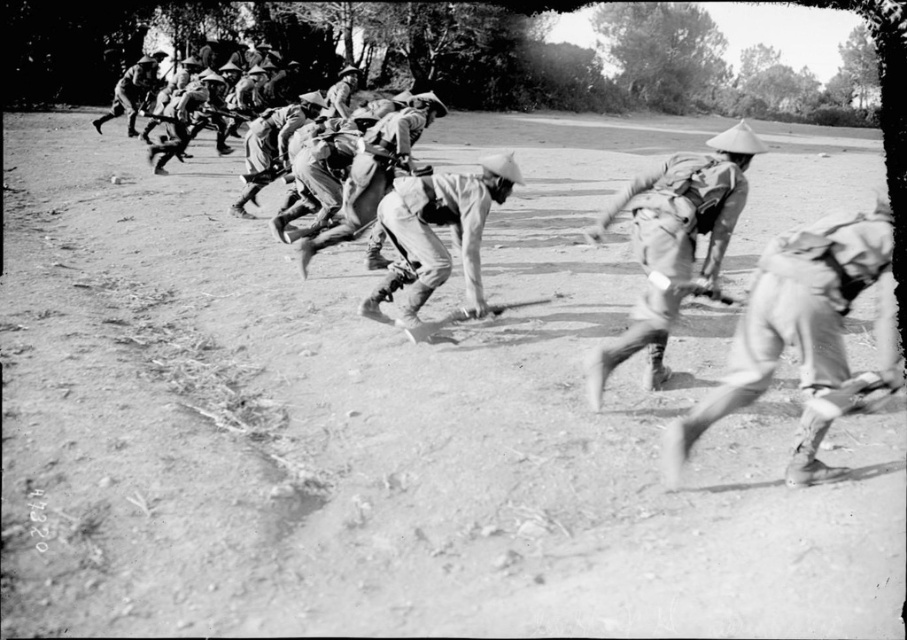
Question: Which object is closer to the camera taking this photo?

Choices:
 (A) camouflage fabric uniform at center
 (B) light gray uniform at center
 (C) light brown uniform at upper left
 (D) light brown uniform at center

Answer: (A)

Question: Is light brown uniform at center positioned in front of light gray uniform at center?

Choices:
 (A) no
 (B) yes

Answer: (B)

Question: Is camouflage fabric uniform at center positioned behind uniformed soldier at center?

Choices:
 (A) yes
 (B) no

Answer: (B)

Question: Does light gray uniform at center have a larger size compared to uniformed soldier at center?

Choices:
 (A) yes
 (B) no

Answer: (B)

Question: Among these points, which one is farthest from the camera?

Choices:
 (A) (641, 308)
 (B) (402, 275)

Answer: (B)

Question: Among these objects, which one is farthest from the camera?

Choices:
 (A) light brown uniform at center
 (B) light gray uniform at center
 (C) uniformed soldier at center
 (D) camouflage fabric uniform at center

Answer: (C)